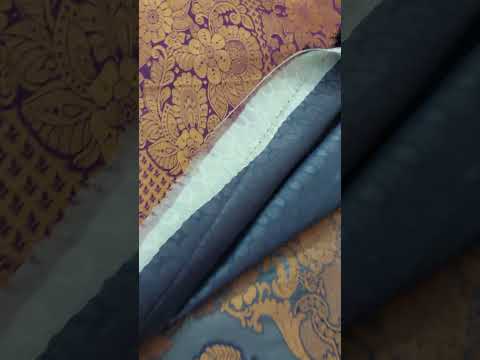
Where is `fabric`? The width and height of the screenshot is (480, 360). fabric is located at coordinates (186, 46).